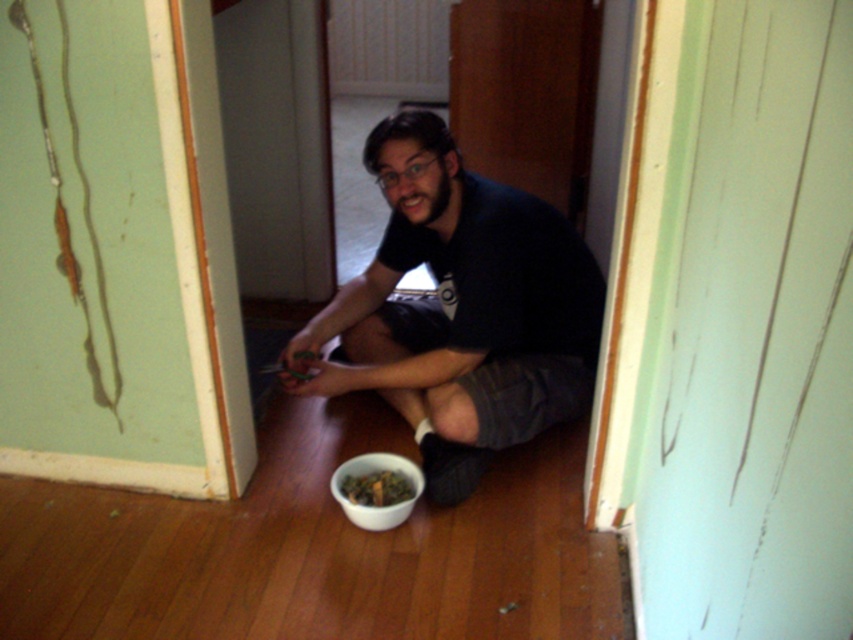
Which of these two, dark gray cotton shirt at center or green leafy material bowl at lower center, stands taller?

dark gray cotton shirt at center

Based on the photo, who is positioned more to the right, dark gray cotton shirt at center or green leafy material bowl at lower center?

From the viewer's perspective, dark gray cotton shirt at center appears more on the right side.

Identify the location of dark gray cotton shirt at center. The image size is (853, 640). (460, 310).

Locate an element on the screen. dark gray cotton shirt at center is located at coordinates (460, 310).